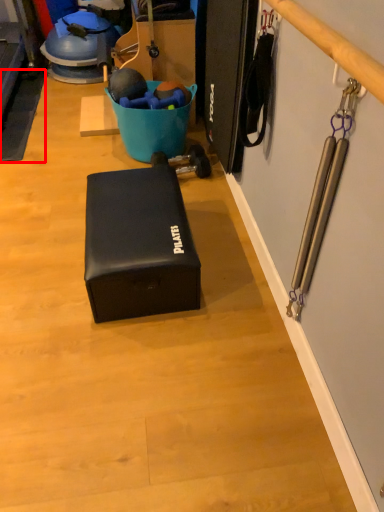
Question: From the image's perspective, what is the correct spatial relationship of yoga mat (annotated by the red box) in relation to box?

Choices:
 (A) above
 (B) below

Answer: (A)